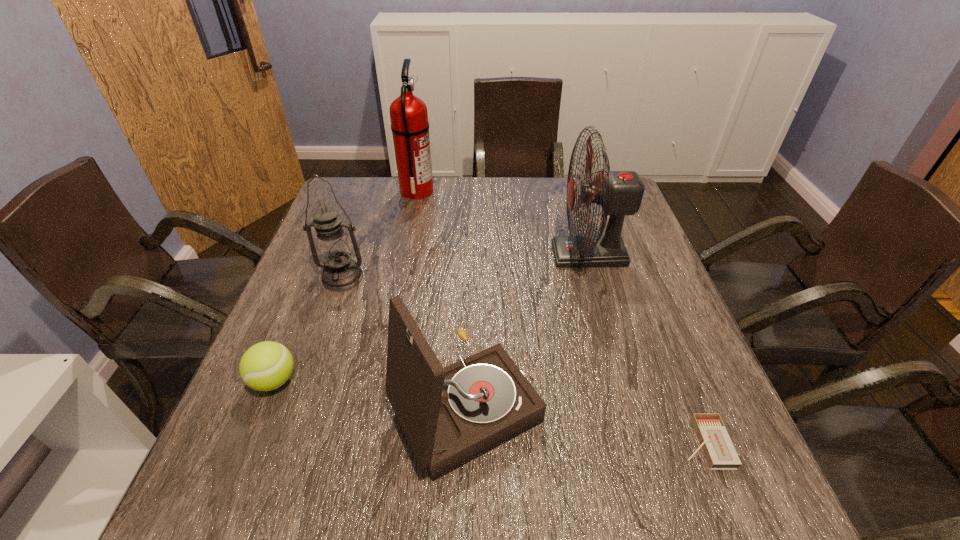
Where is `free space located 0.350m on the right of the oil lamp`? Image resolution: width=960 pixels, height=540 pixels. free space located 0.350m on the right of the oil lamp is located at coordinates (505, 278).

Image resolution: width=960 pixels, height=540 pixels. Identify the location of free location located on the back of the phonograph record. (469, 288).

Where is `vacant region located on the right of the tennis ball`? This screenshot has width=960, height=540. vacant region located on the right of the tennis ball is located at coordinates (378, 381).

Locate an element on the screen. This screenshot has width=960, height=540. free region located 0.150m on the striking surface of the shortest object is located at coordinates (598, 443).

Image resolution: width=960 pixels, height=540 pixels. In order to click on vacant space located on the striking surface of the shortest object in this screenshot , I will do `click(569, 443)`.

Find the location of a particular element. The width and height of the screenshot is (960, 540). vacant area situated 0.360m on the striking surface of the shortest object is located at coordinates (480, 443).

Where is `object located in the far edge section of the desktop`? The image size is (960, 540). object located in the far edge section of the desktop is located at coordinates (409, 118).

You are a GUI agent. You are given a task and a screenshot of the screen. Output one action in this format:
    pyautogui.click(x=<x>, y=<y>)
    Task: Click on the object present at the near edge
    This screenshot has height=540, width=960.
    Given the screenshot: What is the action you would take?
    pyautogui.click(x=450, y=416)

Find the location of a particular element. oil lamp located in the left edge section of the desktop is located at coordinates (340, 273).

I want to click on tennis ball that is at the left edge, so click(265, 366).